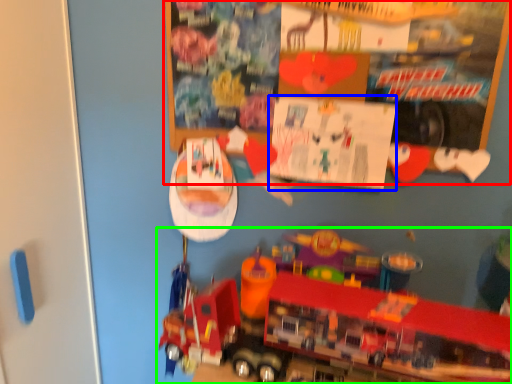
Question: Considering the real-world distances, which object is closest to bulletin board (highlighted by a red box)? poster page (highlighted by a blue box) or toy (highlighted by a green box).

Choices:
 (A) poster page
 (B) toy

Answer: (A)